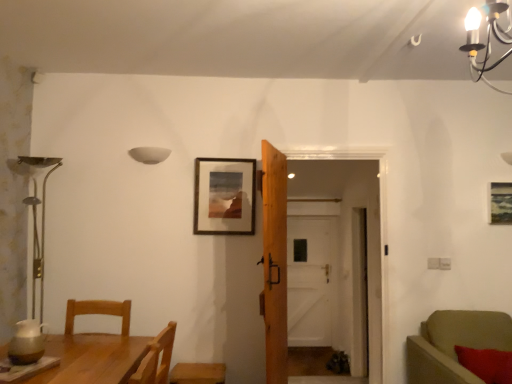
You are a GUI agent. You are given a task and a screenshot of the screen. Output one action in this format:
    pyautogui.click(x=<x>, y=<y>)
    Task: Click on the wooden armchair at lower center
    
    Given the screenshot: What is the action you would take?
    pyautogui.click(x=198, y=373)

The width and height of the screenshot is (512, 384). Describe the element at coordinates (92, 359) in the screenshot. I see `wooden table at lower left` at that location.

Image resolution: width=512 pixels, height=384 pixels. Identify the location of wooden table at lower left. (92, 359).

Describe the element at coordinates (454, 344) in the screenshot. The height and width of the screenshot is (384, 512). I see `velvet green sofa at right` at that location.

Describe the element at coordinates (224, 196) in the screenshot. I see `wooden picture frame at center, the second picture frame when ordered from right to left` at that location.

Where is `wooden picture frame at upper right, positioned as the 1th picture frame in right-to-left order`? The height and width of the screenshot is (384, 512). wooden picture frame at upper right, positioned as the 1th picture frame in right-to-left order is located at coordinates (500, 203).

You are a GUI agent. You are given a task and a screenshot of the screen. Output one action in this format:
    pyautogui.click(x=<x>, y=<y>)
    Task: Click on the wooden armchair at lower center
    
    Given the screenshot: What is the action you would take?
    pyautogui.click(x=198, y=373)

Which object is closer to the camera, wooden table at lower left or white matte bowl at upper center?

wooden table at lower left is more forward.

Who is shorter, wooden table at lower left or white matte bowl at upper center?

white matte bowl at upper center is shorter.

At what (x,y) coordinates should I click in order to perform the action: click on table below the white matte bowl at upper center (from a real-world perspective). Please return your answer as a coordinate pair (x, y). The height and width of the screenshot is (384, 512). Looking at the image, I should click on (92, 359).

Choose the correct answer: Is wooden table at lower left inside white matte bowl at upper center or outside it?

wooden table at lower left lies outside white matte bowl at upper center.

Is wooden door at center, positioned as the second door in right-to-left order, aimed at wooden picture frame at upper right, the second picture frame when ordered from left to right?

No, wooden door at center, positioned as the second door in right-to-left order, is not turned towards wooden picture frame at upper right, the second picture frame when ordered from left to right.

There is a wooden picture frame at upper right, positioned as the 1th picture frame in right-to-left order. Where is `the 1st door below it (from the image's perspective)`? The height and width of the screenshot is (384, 512). the 1st door below it (from the image's perspective) is located at coordinates (274, 262).

Which point is more distant from viewer, (272, 203) or (492, 193)?

Point (492, 193)

Does wooden door at center, positioned as the second door in right-to-left order, touch wooden picture frame at upper right, the second picture frame when ordered from left to right?

wooden door at center, positioned as the second door in right-to-left order, and wooden picture frame at upper right, the second picture frame when ordered from left to right, are not in contact.

Do you think white matte bowl at upper center is within wooden door at center, positioned as the second door in right-to-left order, or outside of it?

white matte bowl at upper center is not inside wooden door at center, positioned as the second door in right-to-left order, it's outside.

Between white matte bowl at upper center and wooden door at center, positioned as the second door in right-to-left order, which one has smaller size?

white matte bowl at upper center is smaller.

From the image's perspective, between white matte bowl at upper center and wooden door at center, positioned as the second door in right-to-left order, who is located below?

From the image's view, wooden door at center, positioned as the second door in right-to-left order, is below.

Which is behind, point (140, 160) or point (266, 245)?

Positioned behind is point (140, 160).

Consider the image. Which object is closer to the camera, white matte bowl at upper center or white wooden door at center, acting as the 2th door starting from the left?

white matte bowl at upper center is closer to the camera.

From the image's perspective, which object appears higher, white matte bowl at upper center or white wooden door at center, the 1th door positioned from the right?

From the image's view, white matte bowl at upper center is above.

Is white matte bowl at upper center facing towards white wooden door at center, the 1th door in the back-to-front sequence?

No, white matte bowl at upper center does not turn towards white wooden door at center, the 1th door in the back-to-front sequence.

Is wooden armchair at lower center oriented towards wooden door at center, placed as the first door when sorted from front to back?

No, wooden armchair at lower center is not aimed at wooden door at center, placed as the first door when sorted from front to back.

Between wooden armchair at lower center and wooden door at center, the second door positioned from the back, which one has less height?

Standing shorter between the two is wooden armchair at lower center.

How much distance is there between wooden armchair at lower center and wooden door at center, placed as the first door when sorted from front to back?

wooden armchair at lower center is 61.08 centimeters from wooden door at center, placed as the first door when sorted from front to back.

Which of these two, wooden armchair at lower center or wooden door at center, placed as the first door when sorted from front to back, is thinner?

wooden door at center, placed as the first door when sorted from front to back.

Is white matte bowl at upper center beside wooden picture frame at center, the second picture frame when ordered from right to left?

No, white matte bowl at upper center is not making contact with wooden picture frame at center, the second picture frame when ordered from right to left.

From the image's perspective, is white matte bowl at upper center located above or below wooden picture frame at center, arranged as the 1th picture frame when viewed from the left?

Based on their image positions, white matte bowl at upper center is located above wooden picture frame at center, arranged as the 1th picture frame when viewed from the left.

Is white matte bowl at upper center wider than wooden picture frame at center, the second picture frame when ordered from right to left?

Yes, white matte bowl at upper center is wider than wooden picture frame at center, the second picture frame when ordered from right to left.

Between white matte bowl at upper center and wooden picture frame at center, the second picture frame when ordered from right to left, which one is positioned behind?

wooden picture frame at center, the second picture frame when ordered from right to left, is behind.

Is point (203, 182) positioned before point (186, 382)?

No, (203, 182) is further to viewer.

Could you tell me if wooden picture frame at center, the second picture frame when ordered from right to left, is facing wooden armchair at lower center?

No, wooden picture frame at center, the second picture frame when ordered from right to left, is not turned towards wooden armchair at lower center.

Which object is closer to the camera, wooden picture frame at center, arranged as the 1th picture frame when viewed from the left, or wooden armchair at lower center?

wooden armchair at lower center.

Identify the location of table on the right of white matte bowl at upper center. (92, 359).

Where is `the 1st picture frame above the wooden door at center, positioned as the second door in right-to-left order (from a real-world perspective)`? Image resolution: width=512 pixels, height=384 pixels. the 1st picture frame above the wooden door at center, positioned as the second door in right-to-left order (from a real-world perspective) is located at coordinates (500, 203).

From the image, which object appears to be farther from wooden door at center, the first door in the left-to-right sequence, velvet green sofa at right or wooden picture frame at center, the second picture frame when ordered from right to left?

The object further to wooden door at center, the first door in the left-to-right sequence, is velvet green sofa at right.

Estimate the real-world distances between objects in this image. Which object is further from red fuzzy pillow at lower right, white matte bowl at upper center or wooden table at lower left?

Among the two, white matte bowl at upper center is located further to red fuzzy pillow at lower right.

Based on their spatial positions, is wooden picture frame at center, the second picture frame when ordered from right to left, or wooden door at center, the first door in the left-to-right sequence, further from wooden table at lower left?

The object further to wooden table at lower left is wooden picture frame at center, the second picture frame when ordered from right to left.

When comparing their distances from red fuzzy pillow at lower right, does white matte bowl at upper center or wooden door at center, the second door positioned from the back, seem further?

white matte bowl at upper center is further to red fuzzy pillow at lower right.

Estimate the real-world distances between objects in this image. Which object is further from white matte bowl at upper center, wooden picture frame at upper right, positioned as the 1th picture frame in right-to-left order, or wooden door at center, the second door positioned from the back?

wooden picture frame at upper right, positioned as the 1th picture frame in right-to-left order, lies further to white matte bowl at upper center than the other object.

Considering their positions, is white matte bowl at upper center positioned further to red fuzzy pillow at lower right than wooden armchair at lower center?

Based on the image, white matte bowl at upper center appears to be further to red fuzzy pillow at lower right.

From the image, which object appears to be farther from wooden armchair at lower center, wooden table at lower left or velvet green sofa at right?

Based on the image, velvet green sofa at right appears to be further to wooden armchair at lower center.

Based on their spatial positions, is wooden picture frame at upper right, the second picture frame when ordered from left to right, or velvet green sofa at right closer to white matte bowl at upper center?

velvet green sofa at right lies closer to white matte bowl at upper center than the other object.

Identify the location of chair between wooden picture frame at center, arranged as the 1th picture frame when viewed from the left, and wooden picture frame at upper right, the second picture frame when ordered from left to right. (454, 344).

Identify the location of pillow between velvet green sofa at right and white wooden door at center, the 1th door in the back-to-front sequence, in the front-back direction. (487, 364).

I want to click on door between wooden table at lower left and white matte bowl at upper center along the z-axis, so click(x=274, y=262).

At what (x,y) coordinates should I click in order to perform the action: click on door positioned between wooden table at lower left and wooden picture frame at center, the second picture frame when ordered from right to left, from near to far. Please return your answer as a coordinate pair (x, y). The width and height of the screenshot is (512, 384). Looking at the image, I should click on (274, 262).